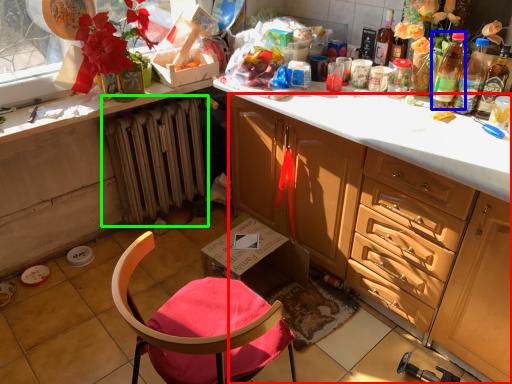
Question: Based on their relative distances, which object is farther from cabinetry (highlighted by a red box)? Choose from bottle (highlighted by a blue box) and radiator (highlighted by a green box).

Choices:
 (A) bottle
 (B) radiator

Answer: (B)